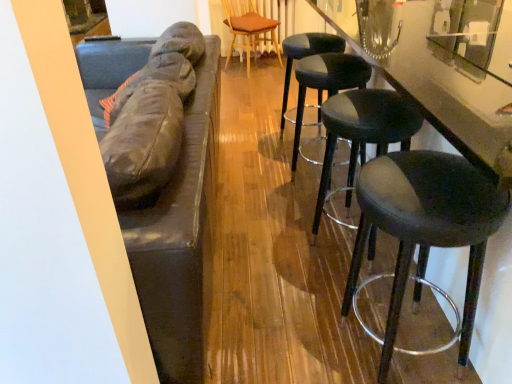
Locate an element on the screen. The image size is (512, 384). free space in front of wooden textured chair at center is located at coordinates (256, 85).